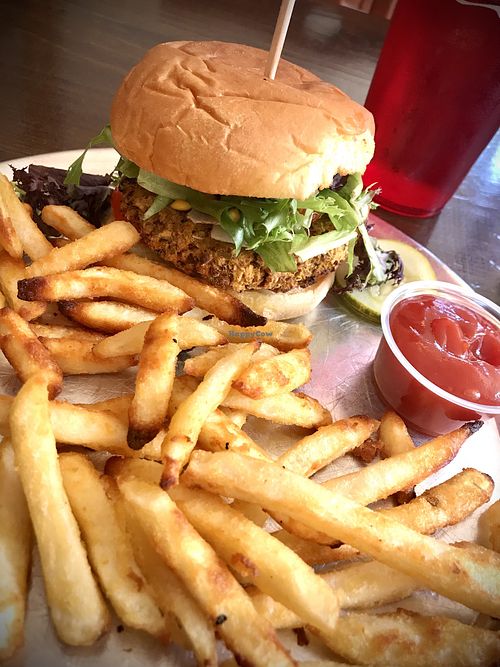
Locate an element on the screen. reflected light on translucent plastic sauce container is located at coordinates (449, 422).